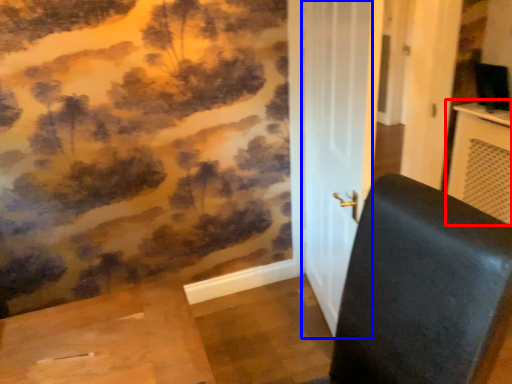
Question: Among these objects, which one is nearest to the camera, table (highlighted by a red box) or screen door (highlighted by a blue box)?

Choices:
 (A) table
 (B) screen door

Answer: (B)